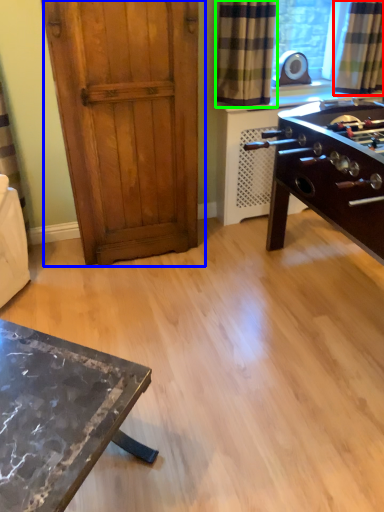
Question: Which object is positioned closest to curtain (highlighted by a red box)? Select from door (highlighted by a blue box) and curtain (highlighted by a green box).

Choices:
 (A) door
 (B) curtain

Answer: (B)